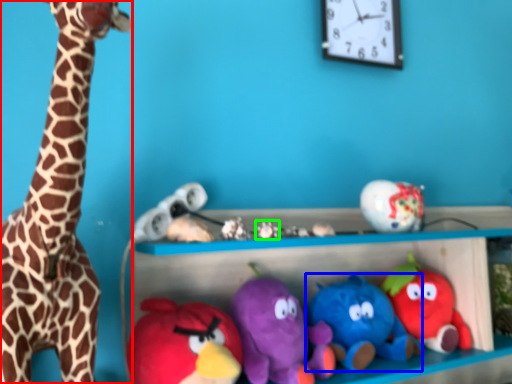
Question: Which object is the farthest from giraffe (highlighted by a red box)? Choose among these: toy (highlighted by a blue box) or toy (highlighted by a green box).

Choices:
 (A) toy
 (B) toy

Answer: (A)